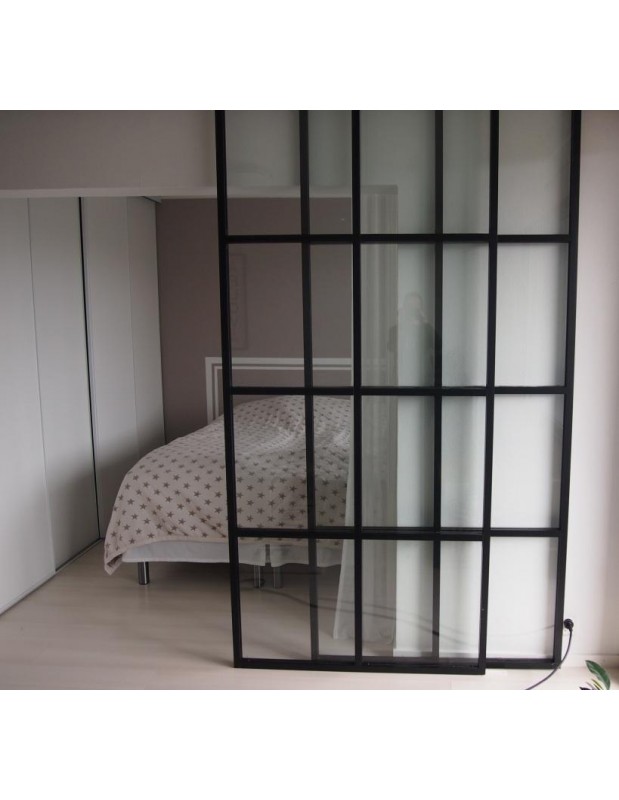
Identify the location of point where cable enters the wall. This screenshot has width=619, height=800. (569, 626).